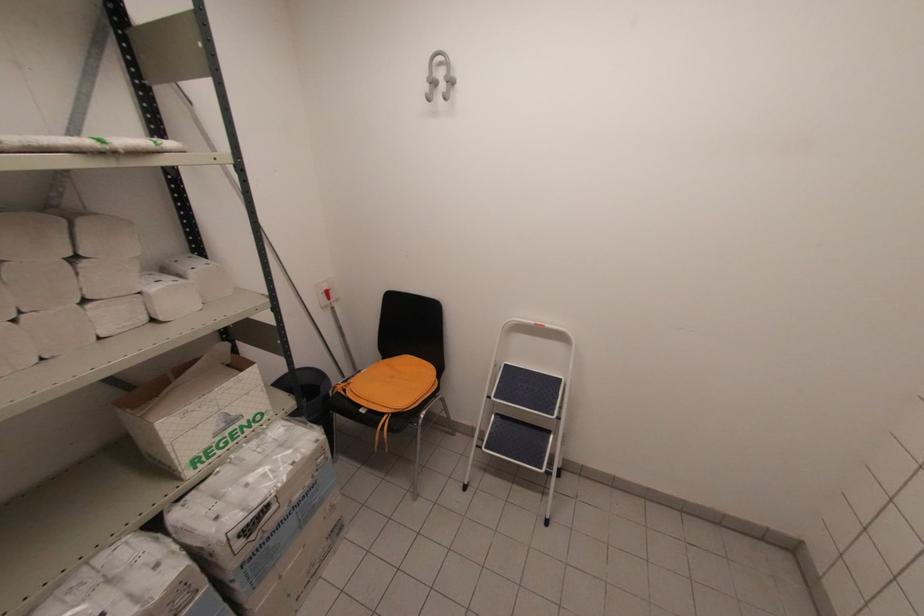
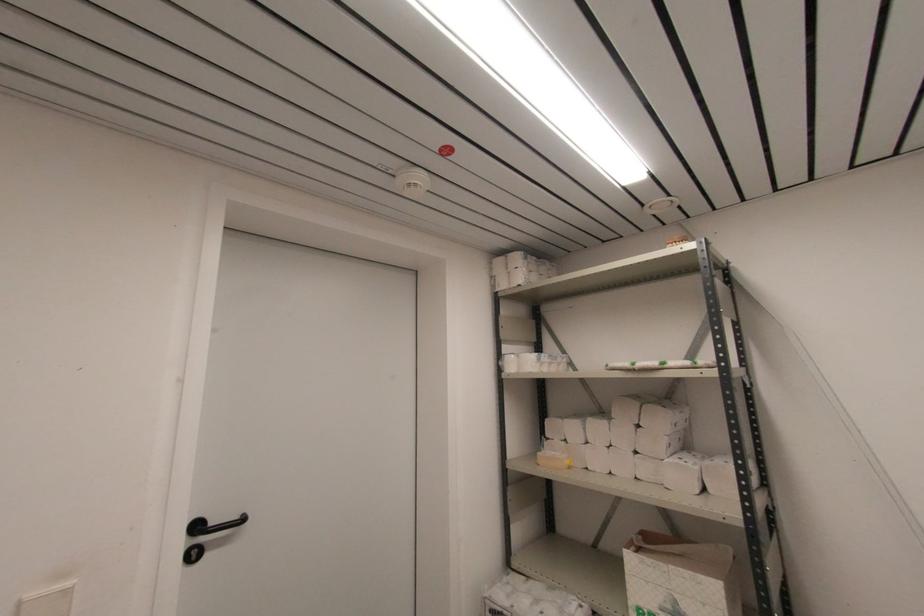
The point at (224, 426) is marked in the first image. Where is the corresponding point in the second image?

(671, 609)